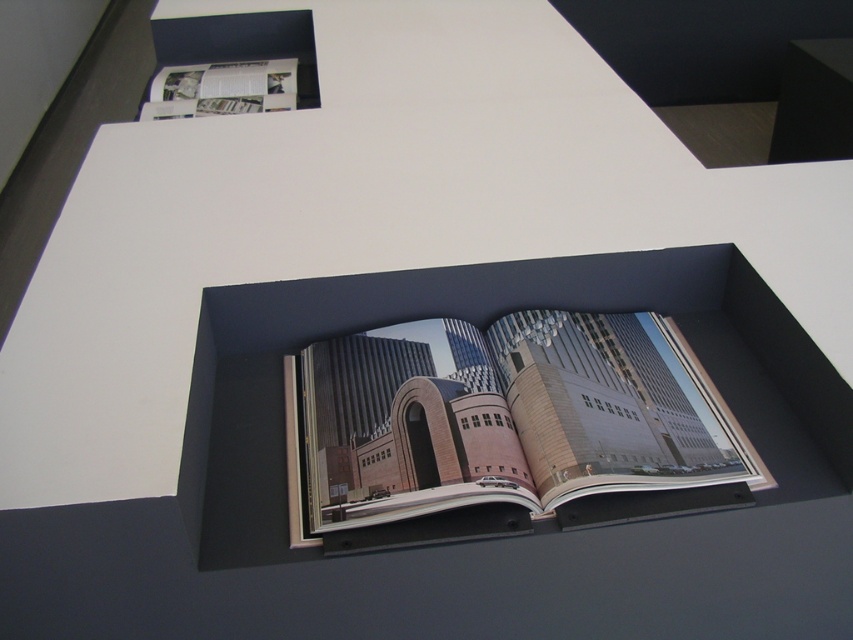
Who is higher up, matte paper book at center or white glossy magazine at upper left?

white glossy magazine at upper left is higher up.

Between point (577, 394) and point (166, 93), which one is positioned in front?

Point (577, 394) is in front.

Is point (607, 440) less distant than point (180, 65)?

Yes, it is.

Locate an element on the screen. The height and width of the screenshot is (640, 853). matte paper book at center is located at coordinates pyautogui.click(x=503, y=426).